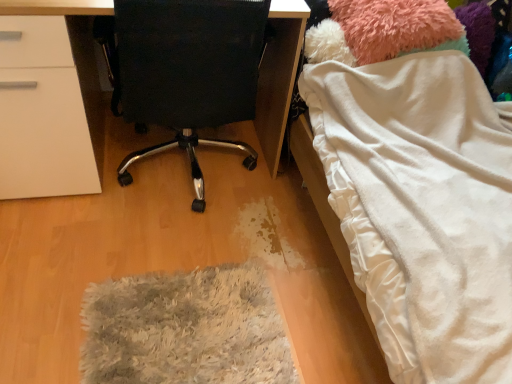
Question: From a real-world perspective, is gray shaggy rug at lower center beneath fuzzy pink teddy at upper right?

Choices:
 (A) yes
 (B) no

Answer: (A)

Question: Can you confirm if gray shaggy rug at lower center is shorter than fuzzy pink teddy at upper right?

Choices:
 (A) no
 (B) yes

Answer: (B)

Question: Is the depth of gray shaggy rug at lower center less than that of fuzzy pink teddy at upper right?

Choices:
 (A) no
 (B) yes

Answer: (B)

Question: From the image's perspective, is gray shaggy rug at lower center below fuzzy pink teddy at upper right?

Choices:
 (A) yes
 (B) no

Answer: (A)

Question: Can you confirm if gray shaggy rug at lower center is positioned to the right of fuzzy pink teddy at upper right?

Choices:
 (A) no
 (B) yes

Answer: (A)

Question: Choose the correct answer: Is gray shaggy rug at lower center inside white soft blanket at right or outside it?

Choices:
 (A) inside
 (B) outside

Answer: (B)

Question: Looking at the image, does gray shaggy rug at lower center seem bigger or smaller compared to white soft blanket at right?

Choices:
 (A) small
 (B) big

Answer: (A)

Question: Considering the positions of gray shaggy rug at lower center and white soft blanket at right in the image, is gray shaggy rug at lower center taller or shorter than white soft blanket at right?

Choices:
 (A) tall
 (B) short

Answer: (B)

Question: Based on their positions, is gray shaggy rug at lower center located to the left or right of white soft blanket at right?

Choices:
 (A) left
 (B) right

Answer: (A)

Question: Considering the positions of white soft blanket at right and gray shaggy rug at lower center in the image, is white soft blanket at right taller or shorter than gray shaggy rug at lower center?

Choices:
 (A) short
 (B) tall

Answer: (B)

Question: From a real-world perspective, relative to gray shaggy rug at lower center, is white soft blanket at right vertically above or below?

Choices:
 (A) above
 (B) below

Answer: (A)

Question: Based on their positions, is white soft blanket at right located to the left or right of gray shaggy rug at lower center?

Choices:
 (A) left
 (B) right

Answer: (B)

Question: Looking at the image, does white soft blanket at right seem bigger or smaller compared to gray shaggy rug at lower center?

Choices:
 (A) small
 (B) big

Answer: (B)

Question: Is point [x=153, y=302] closer or farther from the camera than point [x=404, y=26]?

Choices:
 (A) closer
 (B) farther

Answer: (A)

Question: Based on their sizes in the image, would you say gray shaggy rug at lower center is bigger or smaller than fuzzy pink teddy at upper right?

Choices:
 (A) small
 (B) big

Answer: (A)